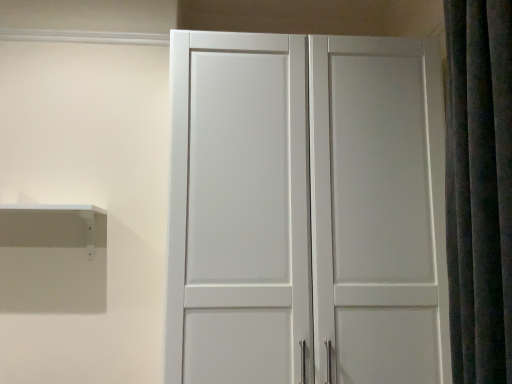
In order to face white matte shelf at left, should I rotate leftwards or rightwards?

A 26.751 degree turn to the left will do.

Where is `white matte shelf at left`? The image size is (512, 384). white matte shelf at left is located at coordinates pyautogui.click(x=53, y=226).

What do you see at coordinates (53, 226) in the screenshot? The height and width of the screenshot is (384, 512). I see `white matte shelf at left` at bounding box center [53, 226].

Locate an element on the screen. dark gray velvet shower curtain at right is located at coordinates (479, 188).

What do you see at coordinates (479, 188) in the screenshot? The height and width of the screenshot is (384, 512). I see `dark gray velvet shower curtain at right` at bounding box center [479, 188].

You are a GUI agent. You are given a task and a screenshot of the screen. Output one action in this format:
    pyautogui.click(x=<x>, y=<y>)
    Task: Click on the white matte shelf at left
    This screenshot has height=384, width=512.
    Given the screenshot: What is the action you would take?
    click(x=53, y=226)

Is dark gray velvet shower curtain at right at the right side of white matte shelf at left?

Indeed, dark gray velvet shower curtain at right is positioned on the right side of white matte shelf at left.

Which object is further away from the camera, dark gray velvet shower curtain at right or white matte shelf at left?

Positioned behind is white matte shelf at left.

Which is further, (508,124) or (81,243)?

The point (81,243) is farther.

From the image's perspective, which one is positioned higher, dark gray velvet shower curtain at right or white matte shelf at left?

dark gray velvet shower curtain at right.

From a real-world perspective, is dark gray velvet shower curtain at right located higher than white matte shelf at left?

Yes.

Looking at their sizes, would you say dark gray velvet shower curtain at right is wider or thinner than white matte shelf at left?

Clearly, dark gray velvet shower curtain at right has more width compared to white matte shelf at left.

From their relative heights in the image, would you say dark gray velvet shower curtain at right is taller or shorter than white matte shelf at left?

Clearly, dark gray velvet shower curtain at right is taller compared to white matte shelf at left.

Is dark gray velvet shower curtain at right bigger or smaller than white matte shelf at left?

dark gray velvet shower curtain at right is bigger than white matte shelf at left.

Choose the correct answer: Is dark gray velvet shower curtain at right inside white matte shelf at left or outside it?

dark gray velvet shower curtain at right exists outside the volume of white matte shelf at left.

Is dark gray velvet shower curtain at right far away from white matte shelf at left?

Yes, dark gray velvet shower curtain at right and white matte shelf at left are located far from each other.

In the scene shown: Is dark gray velvet shower curtain at right aimed at white matte shelf at left?

Yes.

How much distance is there between dark gray velvet shower curtain at right and white matte shelf at left?

dark gray velvet shower curtain at right and white matte shelf at left are 4.67 feet apart.

Identify the location of shelf located below the dark gray velvet shower curtain at right (from the image's perspective). The height and width of the screenshot is (384, 512). (53, 226).

Which is more to the right, white matte shelf at left or dark gray velvet shower curtain at right?

From the viewer's perspective, dark gray velvet shower curtain at right appears more on the right side.

In the scene shown: In the image, is white matte shelf at left positioned in front of or behind dark gray velvet shower curtain at right?

white matte shelf at left is behind dark gray velvet shower curtain at right.

Is point (46, 219) closer or farther from the camera than point (490, 251)?

Point (46, 219) is farther from the camera than point (490, 251).

From the image's perspective, is white matte shelf at left under dark gray velvet shower curtain at right?

Indeed, from the image's perspective, white matte shelf at left is shown beneath dark gray velvet shower curtain at right.

From a real-world perspective, who is located higher, white matte shelf at left or dark gray velvet shower curtain at right?

dark gray velvet shower curtain at right.

Looking at their sizes, would you say white matte shelf at left is wider or thinner than dark gray velvet shower curtain at right?

In the image, white matte shelf at left appears to be more narrow than dark gray velvet shower curtain at right.

Which of these two, white matte shelf at left or dark gray velvet shower curtain at right, stands shorter?

With less height is white matte shelf at left.

Does white matte shelf at left have a smaller size compared to dark gray velvet shower curtain at right?

Correct, white matte shelf at left occupies less space than dark gray velvet shower curtain at right.

Choose the correct answer: Is white matte shelf at left inside dark gray velvet shower curtain at right or outside it?

white matte shelf at left exists outside the volume of dark gray velvet shower curtain at right.

Would you consider white matte shelf at left to be distant from dark gray velvet shower curtain at right?

Yes, white matte shelf at left and dark gray velvet shower curtain at right are located far from each other.

Is white matte shelf at left facing towards dark gray velvet shower curtain at right?

No, white matte shelf at left does not turn towards dark gray velvet shower curtain at right.

What's the angular difference between white matte shelf at left and dark gray velvet shower curtain at right's facing directions?

The angular difference between white matte shelf at left and dark gray velvet shower curtain at right is 91 degrees.

The image size is (512, 384). What are the coordinates of `shelf that appears behind the dark gray velvet shower curtain at right` in the screenshot? It's located at (53, 226).

Find the location of a particular element. The height and width of the screenshot is (384, 512). shower curtain above the white matte shelf at left (from the image's perspective) is located at coordinates (479, 188).

Locate an element on the screen. shelf behind the dark gray velvet shower curtain at right is located at coordinates pos(53,226).